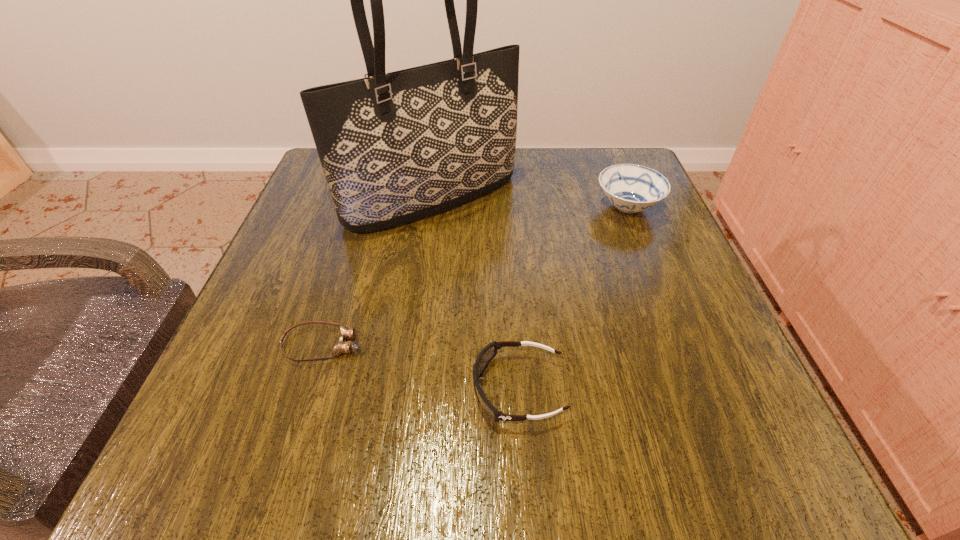
You are a GUI agent. You are given a task and a screenshot of the screen. Output one action in this format:
    pyautogui.click(x=<x>, y=<y>)
    Task: Click on the unoccupied area between the taller goggles and the shortest object
    This screenshot has height=540, width=960.
    Given the screenshot: What is the action you would take?
    pyautogui.click(x=420, y=367)

In order to click on unoccupied position between the third tallest object and the tote bag in this screenshot , I will do `click(475, 294)`.

This screenshot has height=540, width=960. What are the coordinates of `free space between the right goggles and the tallest object` in the screenshot? It's located at (475, 294).

Locate an element on the screen. The image size is (960, 540). free space between the left goggles and the third tallest object is located at coordinates (420, 367).

The image size is (960, 540). In order to click on free space that is in between the rightmost object and the right goggles in this screenshot , I will do `click(573, 298)`.

Image resolution: width=960 pixels, height=540 pixels. I want to click on vacant point located between the tote bag and the soup bowl, so click(530, 203).

Identify which object is the second closest to the right goggles. Please provide its 2D coordinates. Your answer should be formatted as a tuple, i.e. [(x, y)], where the tuple contains the x and y coordinates of a point satisfying the conditions above.

[(396, 147)]

Where is `object that is the closest one to the soup bowl`? object that is the closest one to the soup bowl is located at coordinates (396, 147).

You are a GUI agent. You are given a task and a screenshot of the screen. Output one action in this format:
    pyautogui.click(x=<x>, y=<y>)
    Task: Click on the vacant space that satisfies the following two spatial constraints: 1. on the front side of the rightmost object; 2. on the front lenses and sides of the shortest object
    
    Given the screenshot: What is the action you would take?
    pyautogui.click(x=682, y=345)

Identify the location of free spot that satisfies the following two spatial constraints: 1. on the front side of the second tallest object; 2. on the left side of the tallest object. The image size is (960, 540). (431, 208).